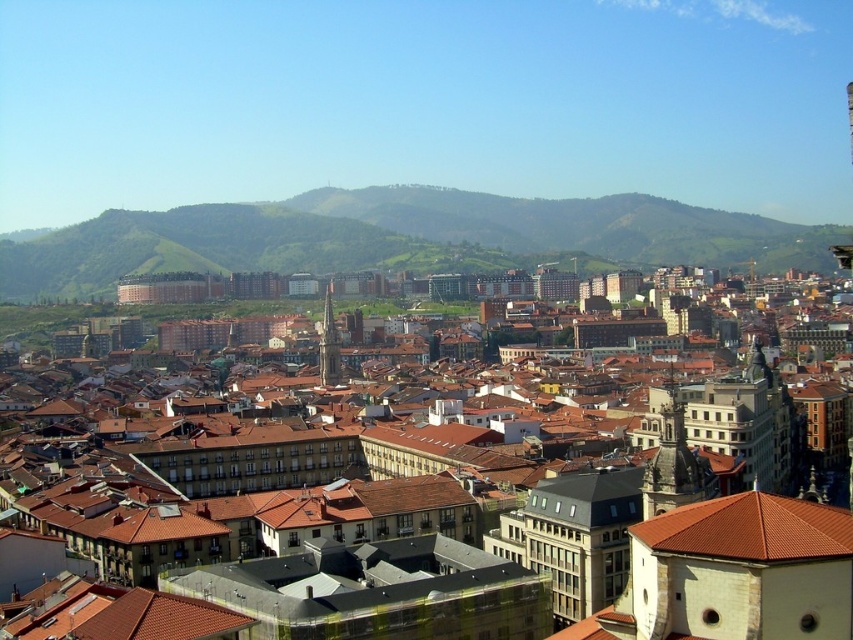
Does brown tiled roofs at center have a greater width compared to brown tile roof at center?

Yes.

Is point (654, 621) positioned before point (804, 557)?

No, (654, 621) is further to viewer.

Is point (808, 536) farther from viewer compared to point (780, 518)?

No, it is in front of (780, 518).

Find the location of a particular element. brown tiled roofs at center is located at coordinates coord(666,532).

Which is below, brown tiled roofs at center or smooth gray stone tower at center?

brown tiled roofs at center is below.

Does point (788, 630) come behind point (335, 348)?

No.

Does point (788, 540) lie in front of point (335, 374)?

That is True.

Where is `brown tiled roofs at center`? The height and width of the screenshot is (640, 853). brown tiled roofs at center is located at coordinates (666, 532).

Is point (311, 218) positioned after point (735, 492)?

Yes, point (311, 218) is behind point (735, 492).

Does point (689, 205) come behind point (740, 532)?

Yes, it is.

Find the location of a particular element. The width and height of the screenshot is (853, 640). green grassy hill at center is located at coordinates (399, 237).